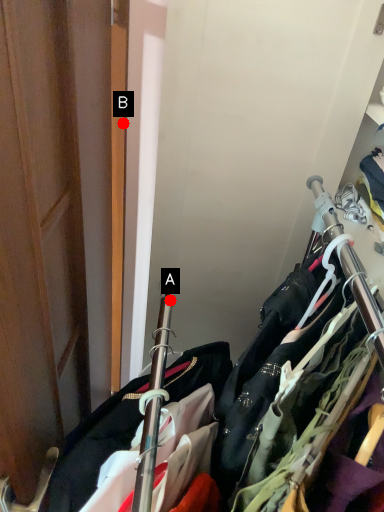
Question: Two points are circled on the image, labeled by A and B beside each circle. Which point is further to the camera?

Choices:
 (A) A is further
 (B) B is further

Answer: (A)